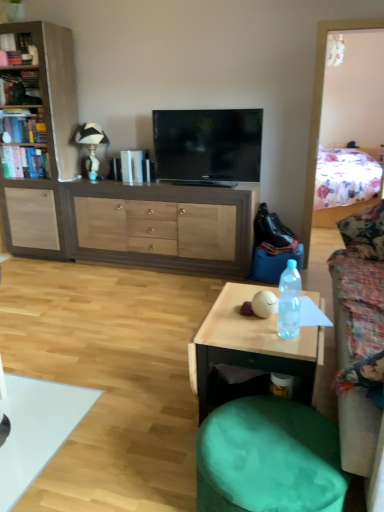
Question: Can you confirm if wooden table at center is thinner than hardcover book at upper left, which ranks as the fourth book in bottom-to-top order?

Choices:
 (A) yes
 (B) no

Answer: (B)

Question: Is wooden table at center next to hardcover book at upper left, which ranks as the fourth book in bottom-to-top order, and touching it?

Choices:
 (A) no
 (B) yes

Answer: (A)

Question: Considering the relative sizes of wooden table at center and hardcover book at upper left, which is counted as the first book, starting from the top, in the image provided, is wooden table at center bigger than hardcover book at upper left, which is counted as the first book, starting from the top,?

Choices:
 (A) yes
 (B) no

Answer: (A)

Question: Is wooden table at center not inside hardcover book at upper left, which is counted as the first book, starting from the top?

Choices:
 (A) no
 (B) yes

Answer: (B)

Question: Is wooden table at center further to the viewer compared to hardcover book at upper left, which is counted as the first book, starting from the top?

Choices:
 (A) yes
 (B) no

Answer: (B)

Question: From the image's perspective, does wooden table at center appear lower than hardcover book at upper left, which is counted as the first book, starting from the top?

Choices:
 (A) no
 (B) yes

Answer: (B)

Question: Considering the relative sizes of hardcover book at left, arranged as the 3th book when ordered from the bottom, and floral fabric couch at right in the image provided, is hardcover book at left, arranged as the 3th book when ordered from the bottom, taller than floral fabric couch at right?

Choices:
 (A) no
 (B) yes

Answer: (A)

Question: Can you confirm if hardcover book at left, arranged as the 3th book when ordered from the bottom, is positioned to the right of floral fabric couch at right?

Choices:
 (A) no
 (B) yes

Answer: (A)

Question: Is hardcover book at left, arranged as the 3th book when ordered from the bottom, behind floral fabric couch at right?

Choices:
 (A) yes
 (B) no

Answer: (A)

Question: From a real-world perspective, is hardcover book at left, arranged as the 3th book when ordered from the bottom, under floral fabric couch at right?

Choices:
 (A) no
 (B) yes

Answer: (A)

Question: Can you see hardcover book at left, which ranks as the 2th book in top-to-bottom order, touching floral fabric couch at right?

Choices:
 (A) no
 (B) yes

Answer: (A)

Question: From a real-world perspective, is hardcover book at left, arranged as the 3th book when ordered from the bottom, on top of floral fabric couch at right?

Choices:
 (A) yes
 (B) no

Answer: (A)

Question: Can you confirm if green fabric swivel chair at lower right is positioned to the right of clear plastic bottle at center?

Choices:
 (A) no
 (B) yes

Answer: (A)